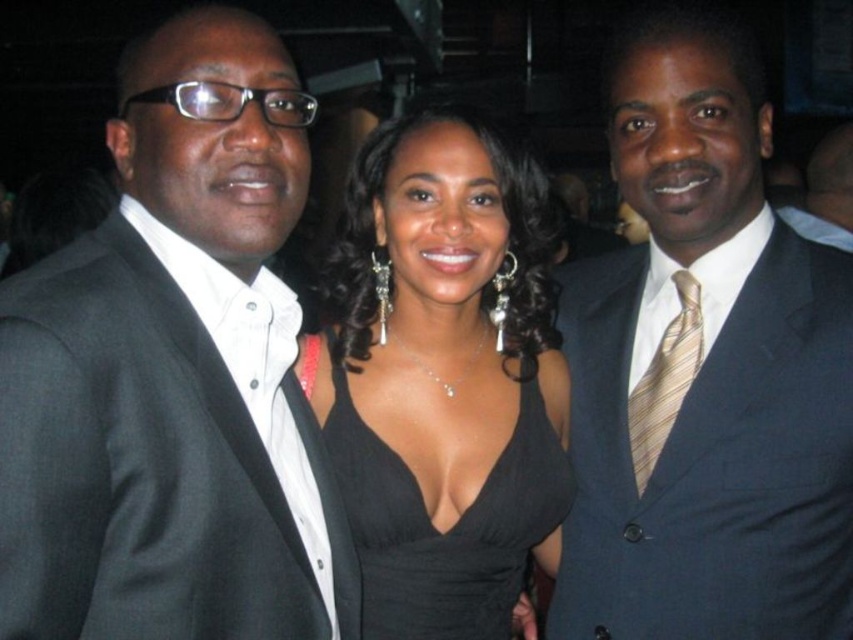
Question: Which object appears farthest from the camera in this image?

Choices:
 (A) black suit at left
 (B) shiny navy suit at center

Answer: (B)

Question: Which of the following is the closest to the observer?

Choices:
 (A) (740, 360)
 (B) (387, 451)

Answer: (A)

Question: Which point is closer to the camera?

Choices:
 (A) (505, 480)
 (B) (326, 547)
 (C) (616, 324)

Answer: (B)

Question: Can you confirm if shiny navy suit at center is positioned to the left of black satin dress at center?

Choices:
 (A) no
 (B) yes

Answer: (A)

Question: Does shiny navy suit at center appear under black satin dress at center?

Choices:
 (A) yes
 (B) no

Answer: (B)

Question: Does black suit at left lie in front of shiny navy suit at center?

Choices:
 (A) no
 (B) yes

Answer: (B)